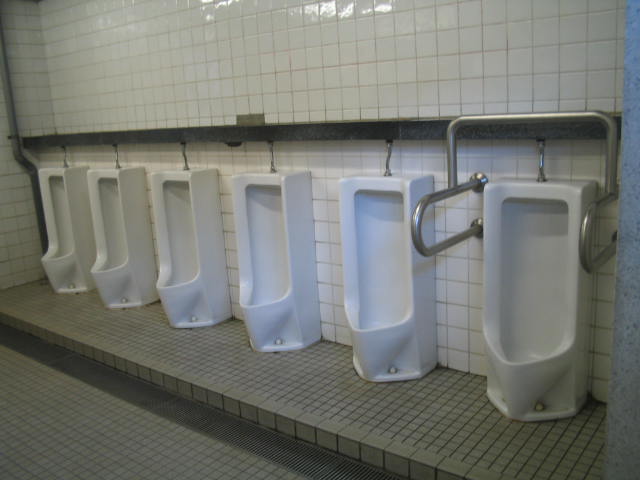
Where is `restroom floor drain`? The height and width of the screenshot is (480, 640). restroom floor drain is located at coordinates (353, 468), (310, 459), (276, 447), (236, 430), (191, 418), (143, 395), (111, 370), (73, 359), (29, 341), (10, 326).